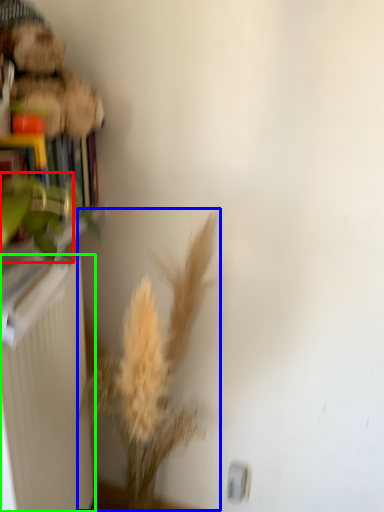
Question: Which is nearer to the plant (highlighted by a red box)? floral arrangement (highlighted by a blue box) or radiator (highlighted by a green box).

Choices:
 (A) floral arrangement
 (B) radiator

Answer: (B)